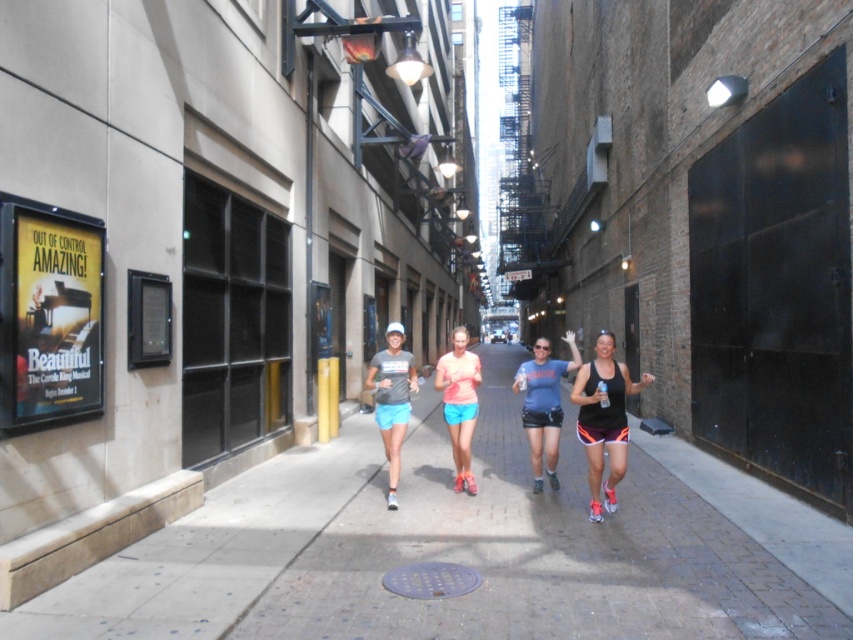
You are standing in the alleyway and want to move from point (518, 369) to point (378, 356). Which direction should you move to get closer to the latter?

You should move towards the camera since point (518, 369) is further away from the camera compared to point (378, 356).